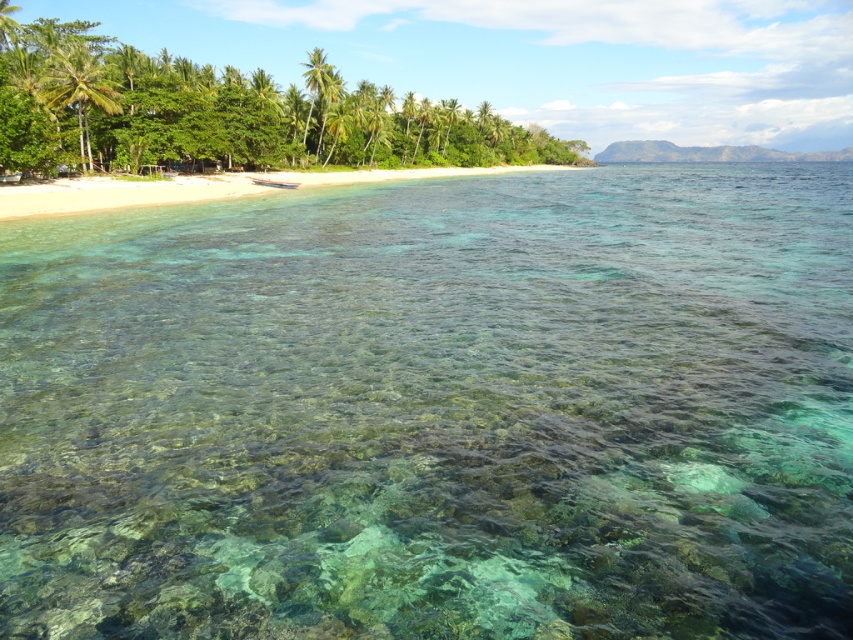
Question: Which point is farther from the camera taking this photo?

Choices:
 (A) (77, 109)
 (B) (310, 67)
 (C) (442, 195)

Answer: (B)

Question: Is clear water at center below green leafy palm tree at center?

Choices:
 (A) yes
 (B) no

Answer: (A)

Question: Is green leafy palm tree at upper left closer to camera compared to green leafy palm tree at center?

Choices:
 (A) yes
 (B) no

Answer: (A)

Question: Does clear water at center have a greater width compared to green leafy palm tree at center?

Choices:
 (A) yes
 (B) no

Answer: (A)

Question: Which is nearer to the green leafy palm tree at upper left?

Choices:
 (A) green leafy palm tree at center
 (B) clear water at center

Answer: (B)

Question: Estimate the real-world distances between objects in this image. Which object is farther from the green leafy palm tree at upper left?

Choices:
 (A) green leafy palm tree at center
 (B) clear water at center

Answer: (A)